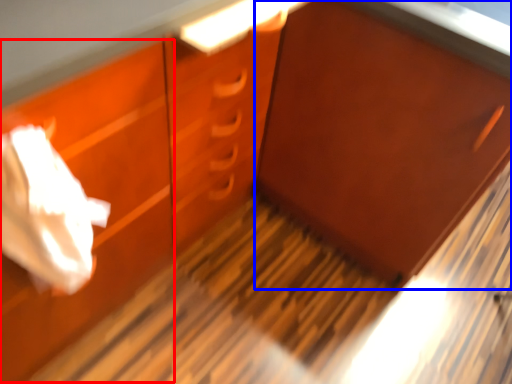
Question: Among these objects, which one is nearest to the camera, drawer (highlighted by a red box) or cabinetry (highlighted by a blue box)?

Choices:
 (A) drawer
 (B) cabinetry

Answer: (A)